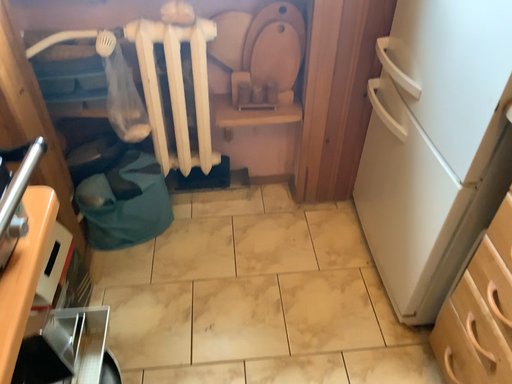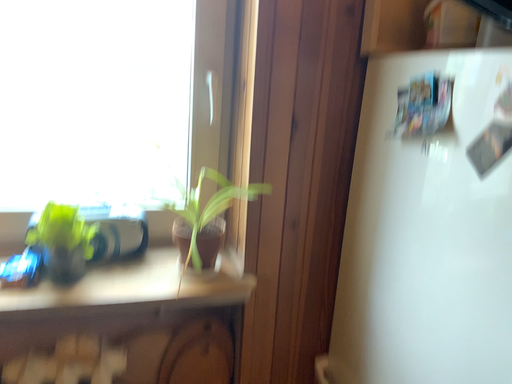
Question: How did the camera likely rotate when shooting the video?

Choices:
 (A) rotated upward
 (B) rotated downward

Answer: (A)